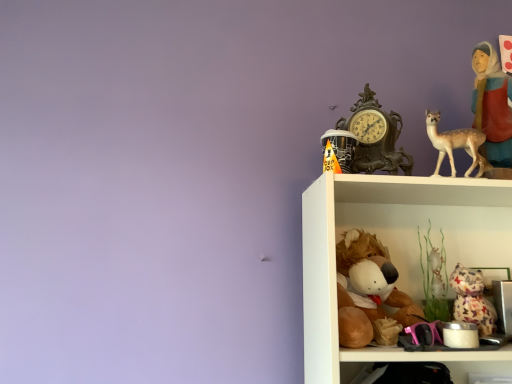
Question: Considering the relative sizes of patterned fabric cat at lower right, which is the 1th toy from right to left, and antique bronze clock at upper right in the image provided, is patterned fabric cat at lower right, which is the 1th toy from right to left, wider than antique bronze clock at upper right?

Choices:
 (A) no
 (B) yes

Answer: (B)

Question: Can you confirm if patterned fabric cat at lower right, which is the 1th toy from right to left, is positioned to the right of antique bronze clock at upper right?

Choices:
 (A) yes
 (B) no

Answer: (A)

Question: From a real-world perspective, is patterned fabric cat at lower right, the third toy positioned from the left, over antique bronze clock at upper right?

Choices:
 (A) no
 (B) yes

Answer: (A)

Question: Is patterned fabric cat at lower right, which is the 1th toy from right to left, outside of antique bronze clock at upper right?

Choices:
 (A) yes
 (B) no

Answer: (A)

Question: From a real-world perspective, is patterned fabric cat at lower right, the third toy positioned from the left, below antique bronze clock at upper right?

Choices:
 (A) no
 (B) yes

Answer: (B)

Question: From the image's perspective, is patterned fabric cat at lower right, the third toy positioned from the left, under antique bronze clock at upper right?

Choices:
 (A) no
 (B) yes

Answer: (B)

Question: From the image's perspective, does matte red fabric at upper right appear higher than brown plush toy at lower center, the 2th toy from the right?

Choices:
 (A) no
 (B) yes

Answer: (B)

Question: Considering the relative positions of matte red fabric at upper right and brown plush toy at lower center, the 2th toy positioned from the left, in the image provided, is matte red fabric at upper right behind brown plush toy at lower center, the 2th toy positioned from the left,?

Choices:
 (A) yes
 (B) no

Answer: (A)

Question: Is brown plush toy at lower center, the 2th toy from the right, a part of matte red fabric at upper right?

Choices:
 (A) yes
 (B) no

Answer: (B)

Question: Is matte red fabric at upper right at the right side of brown plush toy at lower center, the 2th toy positioned from the left?

Choices:
 (A) yes
 (B) no

Answer: (A)

Question: Can we say matte red fabric at upper right lies outside brown plush toy at lower center, the 2th toy from the right?

Choices:
 (A) yes
 (B) no

Answer: (A)

Question: From a real-world perspective, is matte red fabric at upper right under brown plush toy at lower center, the 2th toy from the right?

Choices:
 (A) no
 (B) yes

Answer: (A)

Question: Is light beige porcelain deer at upper right smaller than orange paper cone at upper right, the third toy positioned from the right?

Choices:
 (A) no
 (B) yes

Answer: (A)